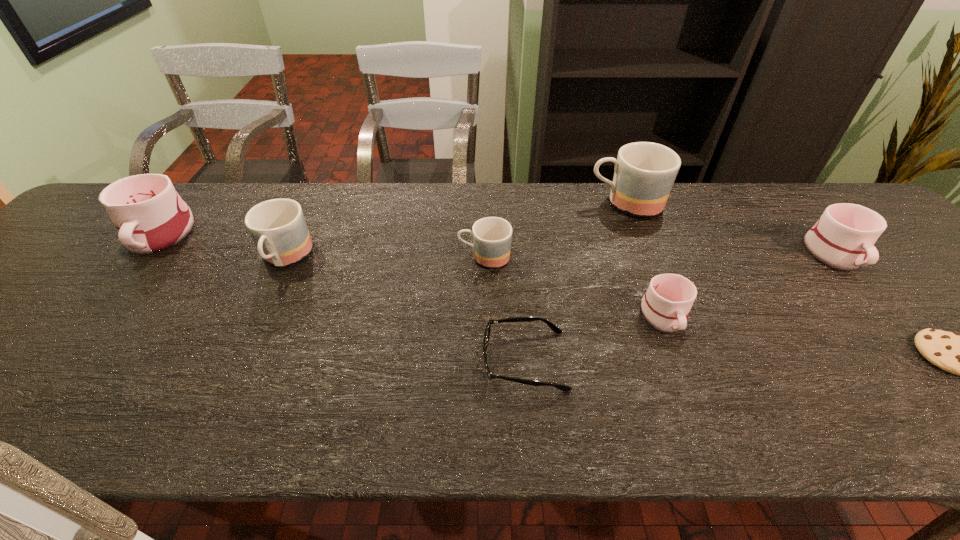
Where is `the nearest mug`? The width and height of the screenshot is (960, 540). the nearest mug is located at coordinates (667, 302).

This screenshot has height=540, width=960. Find the location of `the second white mug from right to left`. the second white mug from right to left is located at coordinates (667, 302).

This screenshot has width=960, height=540. I want to click on spectacles, so click(556, 329).

The height and width of the screenshot is (540, 960). In order to click on vacant area situated on the side with the handle of the farthest blue mug in this screenshot , I will do `click(540, 203)`.

You are a GUI agent. You are given a task and a screenshot of the screen. Output one action in this format:
    pyautogui.click(x=<x>, y=<y>)
    Task: Click on the vacant space located on the side with the handle of the farthest blue mug
    
    Given the screenshot: What is the action you would take?
    pyautogui.click(x=570, y=203)

At what (x,y) coordinates should I click in order to perform the action: click on blank area located on the side with the handle of the farthest blue mug. Please return your answer as a coordinate pair (x, y). The width and height of the screenshot is (960, 540). Looking at the image, I should click on (550, 203).

Identify the location of vacant space located on the side with the handle of the leftmost mug. The width and height of the screenshot is (960, 540). (100, 308).

Image resolution: width=960 pixels, height=540 pixels. I want to click on free space located on the side with the handle of the second mug from left to right, so click(x=216, y=408).

Identify the location of free space located 0.210m on the side with the handle of the rightmost white mug. Image resolution: width=960 pixels, height=540 pixels. (916, 348).

Where is `free point located 0.360m on the side with the handle of the smallest blue mug`? free point located 0.360m on the side with the handle of the smallest blue mug is located at coordinates (318, 257).